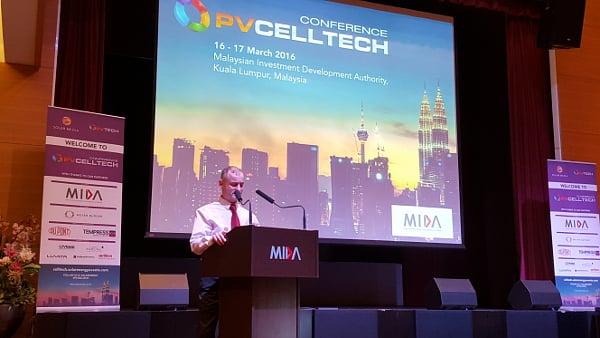
At what (x,y) coordinates should I click in order to perform the action: click on screen. Please return your answer as a coordinate pair (x, y). Looking at the image, I should click on (313, 95).